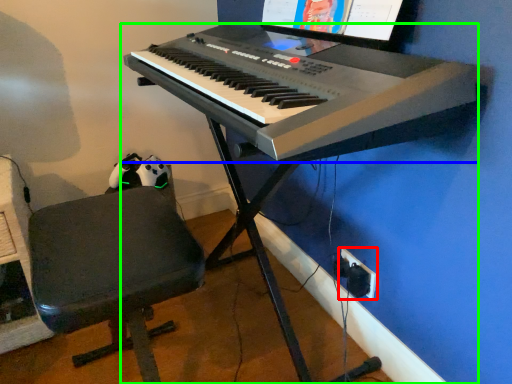
Question: Which is farther away from plug (highlighted by a red box)? musical keyboard (highlighted by a blue box) or piano (highlighted by a green box)?

Choices:
 (A) musical keyboard
 (B) piano

Answer: (A)